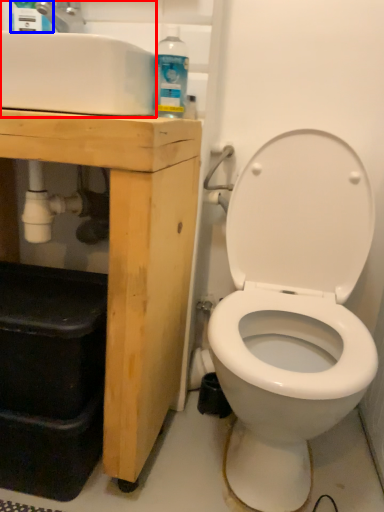
Question: Among these objects, which one is nearest to the camera, sink (highlighted by a red box) or cleaning product (highlighted by a blue box)?

Choices:
 (A) sink
 (B) cleaning product

Answer: (A)